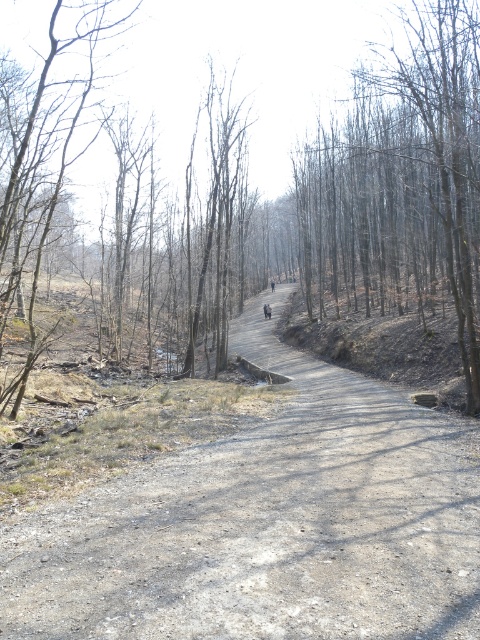
You are standing at the entrance of the path and want to walk to the point marked as point (319, 205). Based on the scene description, where exactly on the path should you head towards?

The point (319, 205) is located on the brown dirt path at center, so you should head towards the center of the path to reach it.

You are standing on the wooded path and see two points marked on the ground. One is at point coordinates point (440, 467) and the other is at point (31, 141). Which point is closer to you as you face the direction the path is heading?

Point (440, 467) is in front of point (31, 141), so the point closer to you would be point (440, 467).